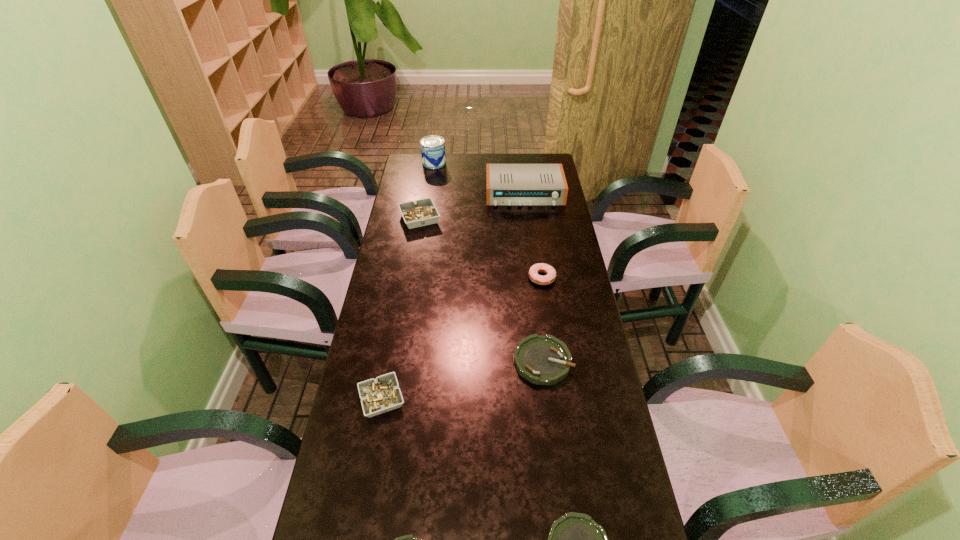
Find the location of a particular element. This screenshot has width=960, height=540. object at the far left corner is located at coordinates (433, 155).

Where is `vacant space at the far edge of the desktop`? The width and height of the screenshot is (960, 540). vacant space at the far edge of the desktop is located at coordinates (445, 175).

Find the location of a particular element. vacant space at the left edge of the desktop is located at coordinates (355, 380).

Where is `free location at the right edge`? The width and height of the screenshot is (960, 540). free location at the right edge is located at coordinates (590, 368).

Identify the location of vacant space at the far left corner. The image size is (960, 540). (411, 162).

This screenshot has height=540, width=960. Identify the location of unoccupied area between the seventh shortest object and the tallest ashtray. (472, 206).

Identify the location of vacant space that's between the farthest object and the pink doughnut. (488, 220).

Locate an element on the screen. The width and height of the screenshot is (960, 540). free space between the second tallest object and the smaller gray ashtray is located at coordinates (453, 296).

You are a GUI agent. You are given a task and a screenshot of the screen. Output one action in this format:
    pyautogui.click(x=<x>, y=<y>)
    Task: Click on the vacant space in between the farthest green ashtray and the third tallest object
    
    Given the screenshot: What is the action you would take?
    pyautogui.click(x=481, y=289)

Identify the location of free spot between the can and the farthest green ashtray. (489, 262).